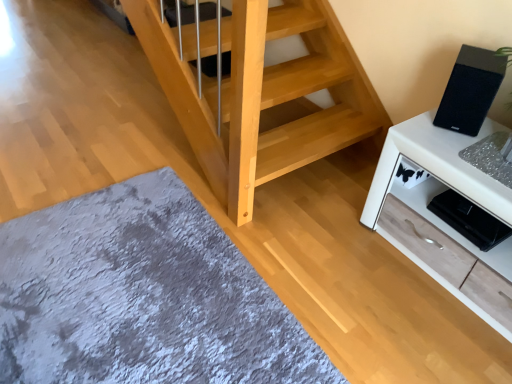
This screenshot has width=512, height=384. Describe the element at coordinates (470, 90) in the screenshot. I see `black matte speaker at upper right` at that location.

Find the location of a particular element. black matte speaker at upper right is located at coordinates (470, 90).

Can you tell me how much gray plush rug at lower left and white wood cabinet at right differ in facing direction?

The angular difference between gray plush rug at lower left and white wood cabinet at right is 91.2 degrees.

Does point (147, 322) lie in front of point (509, 191)?

That is False.

Is the position of gray plush rug at lower left more distant than that of white wood cabinet at right?

No, it is not.

You are a GUI agent. You are given a task and a screenshot of the screen. Output one action in this format:
    pyautogui.click(x=<x>, y=<y>)
    Task: Click on the cabinetry to the right of gray plush rug at lower left
    This screenshot has width=512, height=384.
    Given the screenshot: What is the action you would take?
    pyautogui.click(x=439, y=180)

Consider the image. From the image's perspective, is black matte speaker at upper right beneath gray plush rug at lower left?

No, from the image's perspective, black matte speaker at upper right is not below gray plush rug at lower left.

From a real-world perspective, is black matte speaker at upper right positioned above or below gray plush rug at lower left?

black matte speaker at upper right is above gray plush rug at lower left.

Considering the points (481, 119) and (324, 377), which point is behind, point (481, 119) or point (324, 377)?

Point (481, 119)

Between black matte speaker at upper right and gray plush rug at lower left, which one has less height?

gray plush rug at lower left is shorter.

Would you say white wood cabinet at right is to the left or to the right of gray plush rug at lower left in the picture?

In the image, white wood cabinet at right appears on the right side of gray plush rug at lower left.

From the image's perspective, relative to gray plush rug at lower left, is white wood cabinet at right above or below?

Based on their image positions, white wood cabinet at right is located above gray plush rug at lower left.

Measure the distance between white wood cabinet at right and gray plush rug at lower left.

34.98 inches.

Is white wood cabinet at right positioned with its back to gray plush rug at lower left?

white wood cabinet at right does not have its back to gray plush rug at lower left.

Considering the relative sizes of gray plush rug at lower left and black matte speaker at upper right in the image provided, is gray plush rug at lower left smaller than black matte speaker at upper right?

Actually, gray plush rug at lower left might be larger than black matte speaker at upper right.

Is there a large distance between gray plush rug at lower left and black matte speaker at upper right?

gray plush rug at lower left is far away from black matte speaker at upper right.

From a real-world perspective, which object rests below the other?

gray plush rug at lower left is physically lower.

Which object is more forward, gray plush rug at lower left or black matte speaker at upper right?

gray plush rug at lower left is more forward.

Does black matte speaker at upper right have a smaller size compared to white wood cabinet at right?

Indeed, black matte speaker at upper right has a smaller size compared to white wood cabinet at right.

Is point (476, 112) more distant than point (397, 245)?

No, it is in front of (397, 245).

From a real-world perspective, between black matte speaker at upper right and white wood cabinet at right, who is vertically lower?

white wood cabinet at right, from a real-world perspective.

Consider the image. Does black matte speaker at upper right lie in front of white wood cabinet at right?

No, black matte speaker at upper right is behind white wood cabinet at right.

Is white wood cabinet at right turned away from black matte speaker at upper right?

white wood cabinet at right does not have its back to black matte speaker at upper right.

Which is correct: white wood cabinet at right is inside black matte speaker at upper right, or outside of it?

white wood cabinet at right cannot be found inside black matte speaker at upper right.

Which is more to the left, white wood cabinet at right or black matte speaker at upper right?

black matte speaker at upper right.

Identify the location of mat below the white wood cabinet at right (from the image's perspective). (142, 297).

Where is `appliance to the right of gray plush rug at lower left`? appliance to the right of gray plush rug at lower left is located at coordinates (470, 90).

Based on their spatial positions, is white wood cabinet at right or black matte speaker at upper right closer to gray plush rug at lower left?

white wood cabinet at right.

From the image, which object appears to be nearer to white wood cabinet at right, black matte speaker at upper right or gray plush rug at lower left?

Based on the image, black matte speaker at upper right appears to be nearer to white wood cabinet at right.

Looking at the image, which one is located closer to gray plush rug at lower left, black matte speaker at upper right or white wood cabinet at right?

Among the two, white wood cabinet at right is located nearer to gray plush rug at lower left.

In the scene shown: Considering their positions, is white wood cabinet at right positioned closer to black matte speaker at upper right than gray plush rug at lower left?

white wood cabinet at right is positioned closer to the anchor black matte speaker at upper right.

Based on their spatial positions, is gray plush rug at lower left or black matte speaker at upper right closer to white wood cabinet at right?

Among the two, black matte speaker at upper right is located nearer to white wood cabinet at right.

Based on their spatial positions, is gray plush rug at lower left or white wood cabinet at right further from black matte speaker at upper right?

The object further to black matte speaker at upper right is gray plush rug at lower left.

Identify the location of appliance between gray plush rug at lower left and white wood cabinet at right in the horizontal direction. (470, 90).